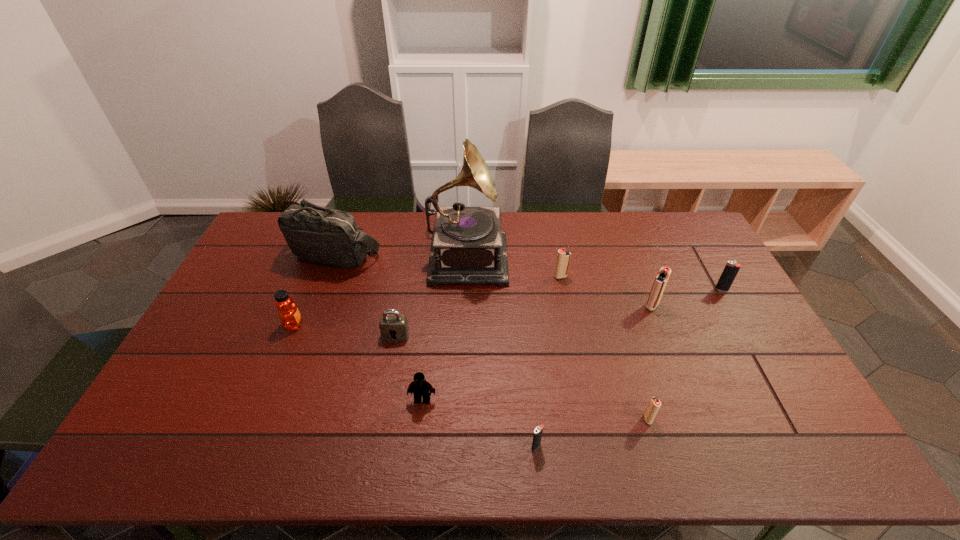
Locate which igniter is the fourth closest to the second nearest red igniter. Please provide its 2D coordinates. Your answer should be formatted as a tuple, i.e. [(x, y)], where the tuple contains the x and y coordinates of a point satisfying the conditions above.

[(538, 431)]

Locate which red igniter ranks second in proximity to the second nearest object. Please provide its 2D coordinates. Your answer should be formatted as a tuple, i.e. [(x, y)], where the tuple contains the x and y coordinates of a point satisfying the conditions above.

[(563, 257)]

Find the location of a particular element. red igniter that is the second closest one to the third nearest igniter is located at coordinates (655, 403).

Where is `vacant area in the image that satisfies the following two spatial constraints: 1. on the horn of the tallest object; 2. at the front of the padlock near the keyhole`? vacant area in the image that satisfies the following two spatial constraints: 1. on the horn of the tallest object; 2. at the front of the padlock near the keyhole is located at coordinates (464, 335).

I want to click on free point that satisfies the following two spatial constraints: 1. on the horn of the tallest object; 2. on the right side of the biggest red igniter, so click(x=465, y=306).

You are a GUI agent. You are given a task and a screenshot of the screen. Output one action in this format:
    pyautogui.click(x=<x>, y=<y>)
    Task: Click on the vacant space that satisfies the following two spatial constraints: 1. at the front of the nearest red igniter near the keyhole; 2. on the left side of the third object from left to right
    The height and width of the screenshot is (540, 960).
    Given the screenshot: What is the action you would take?
    pyautogui.click(x=381, y=419)

The width and height of the screenshot is (960, 540). I want to click on free location that satisfies the following two spatial constraints: 1. on the front label of the honey; 2. on the left side of the third igniter from right to left, so click(256, 419).

Image resolution: width=960 pixels, height=540 pixels. Identify the location of vacant area in the image that satisfies the following two spatial constraints: 1. on the front label of the honey; 2. on the back side of the smallest red igniter. (256, 419).

I want to click on free space in the image that satisfies the following two spatial constraints: 1. at the front padded panel of the second tallest object; 2. on the right side of the ninth object from left to right, so click(317, 306).